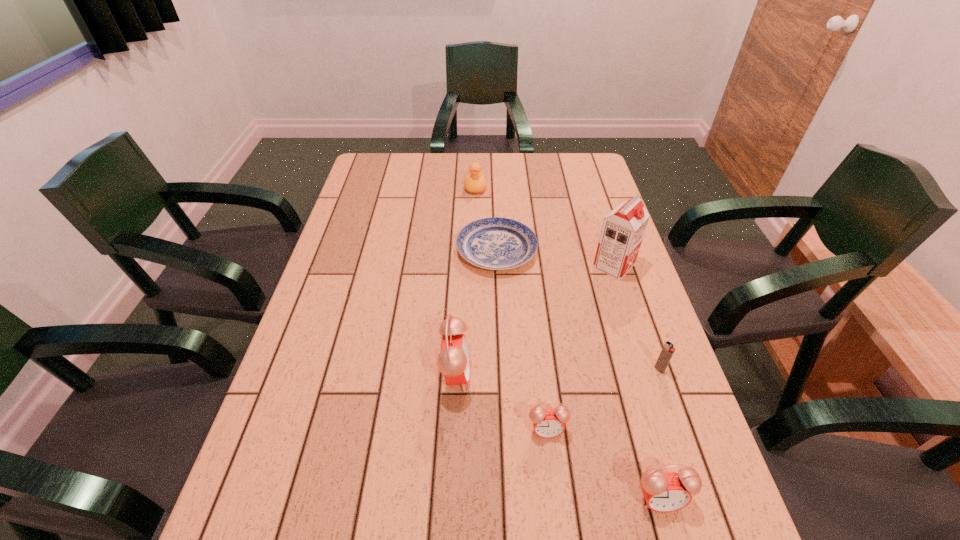
Find the location of a particular element. The height and width of the screenshot is (540, 960). the sixth shortest object is located at coordinates (453, 362).

Identify the location of the farthest alarm clock. The width and height of the screenshot is (960, 540). (453, 362).

Where is `the second alarm clock from right to left`? the second alarm clock from right to left is located at coordinates (548, 423).

Where is `the sixth farthest object`? the sixth farthest object is located at coordinates (548, 423).

Locate an element on the screen. The width and height of the screenshot is (960, 540). the nearest alarm clock is located at coordinates (664, 492).

The width and height of the screenshot is (960, 540). I want to click on the second shortest alarm clock, so click(x=664, y=492).

Locate an element on the screen. This screenshot has width=960, height=540. duck is located at coordinates (475, 182).

The height and width of the screenshot is (540, 960). In order to click on plate in this screenshot , I will do `click(495, 243)`.

The image size is (960, 540). Find the location of `soya milk`. soya milk is located at coordinates (623, 228).

At what (x,y) coordinates should I click in order to perform the action: click on igniter. Please return your answer as a coordinate pair (x, y). The width and height of the screenshot is (960, 540). Looking at the image, I should click on pos(668,350).